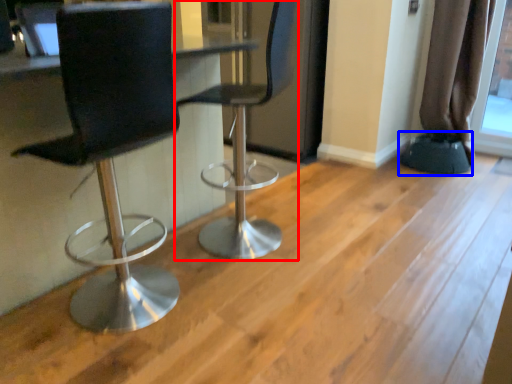
Question: Which object appears closest to the camera in this image, chair (highlighted by a red box) or step stool (highlighted by a blue box)?

Choices:
 (A) chair
 (B) step stool

Answer: (A)